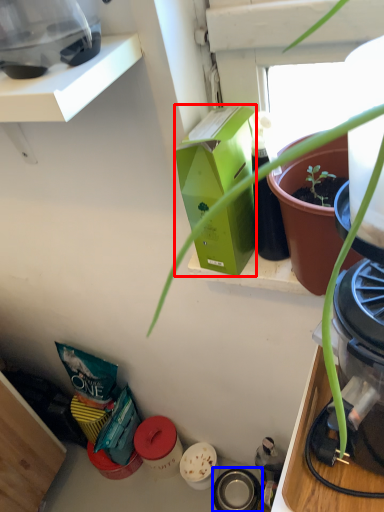
Question: Which object appears closest to the camera in this image, box (highlighted by a red box) or appliance (highlighted by a blue box)?

Choices:
 (A) box
 (B) appliance

Answer: (A)